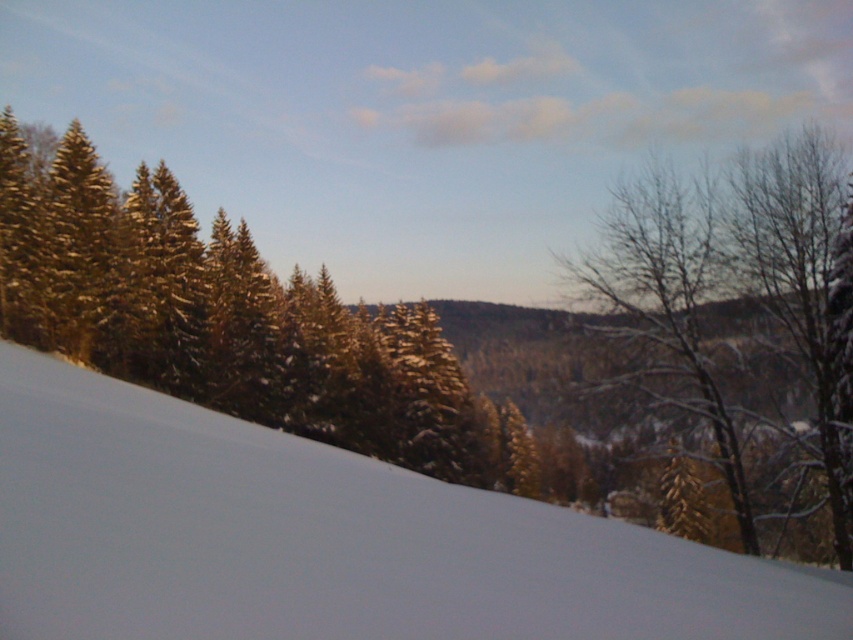
Question: Which point is closer to the camera taking this photo?

Choices:
 (A) (827, 246)
 (B) (532, 584)

Answer: (B)

Question: Is white powdery snow at lower left to the left of snow-covered bare tree at right from the viewer's perspective?

Choices:
 (A) yes
 (B) no

Answer: (A)

Question: Which of the following is the farthest from the observer?

Choices:
 (A) white powdery snow at lower left
 (B) snow-covered bare tree at right

Answer: (B)

Question: Is white powdery snow at lower left behind snow-covered bare tree at right?

Choices:
 (A) yes
 (B) no

Answer: (B)

Question: Observing the image, what is the correct spatial positioning of white powdery snow at lower left in reference to snow-covered bare tree at right?

Choices:
 (A) left
 (B) right

Answer: (A)